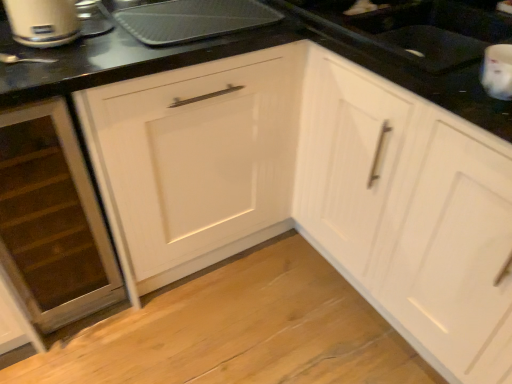
Question: From a real-world perspective, is matte silver toaster at upper left physically located above or below white glossy cabinet at center, the 2th cabinetry viewed from the left?

Choices:
 (A) below
 (B) above

Answer: (B)

Question: Considering the positions of matte silver toaster at upper left and white glossy cabinet at center, the 2th cabinetry viewed from the left, in the image, is matte silver toaster at upper left taller or shorter than white glossy cabinet at center, the 2th cabinetry viewed from the left,?

Choices:
 (A) tall
 (B) short

Answer: (B)

Question: Which is farther from the metallic silver tray at upper center?

Choices:
 (A) matte silver toaster at upper left
 (B) wooden drawer at lower left, marked as the second cabinetry in a right-to-left arrangement
 (C) white glossy cabinet at center, which appears as the first cabinetry when viewed from the right
 (D) white glossy sink at upper right

Answer: (C)

Question: Which is nearer to the wooden drawer at lower left, which is counted as the 1th cabinetry, starting from the left?

Choices:
 (A) metallic silver tray at upper center
 (B) white glossy cabinet at center, which appears as the first cabinetry when viewed from the right
 (C) white glossy sink at upper right
 (D) matte silver toaster at upper left

Answer: (D)